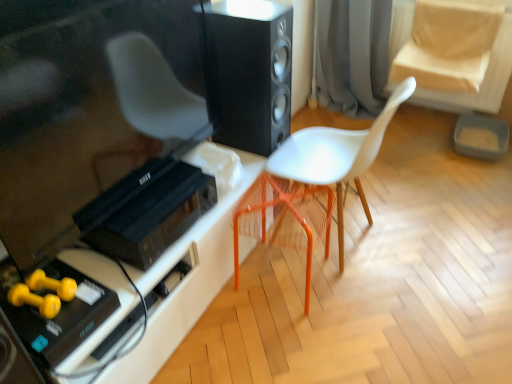
The height and width of the screenshot is (384, 512). Find the location of `free point below orange plastic swivel chair at center (from a real-world perspective)`. free point below orange plastic swivel chair at center (from a real-world perspective) is located at coordinates (282, 279).